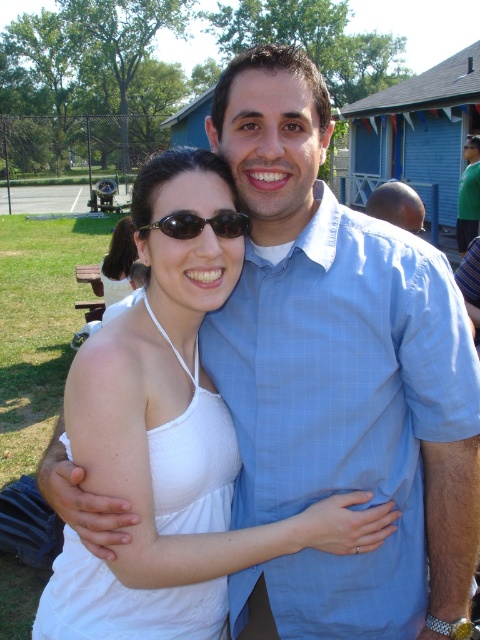
Question: From the image, what is the correct spatial relationship of black plastic goggles at upper center in relation to green fabric shirt at right?

Choices:
 (A) left
 (B) right

Answer: (A)

Question: Observing the image, what is the correct spatial positioning of smooth bald head at center in reference to green fabric shirt at right?

Choices:
 (A) left
 (B) right

Answer: (A)

Question: Which point is closer to the camera?

Choices:
 (A) black plastic goggles at upper center
 (B) smooth bald head at center

Answer: (A)

Question: Which of the following is the closest to the observer?

Choices:
 (A) (459, 182)
 (B) (107, 280)
 (C) (245, 225)

Answer: (C)

Question: Observing the image, what is the correct spatial positioning of smooth bald head at center in reference to white fabric top at center?

Choices:
 (A) above
 (B) below

Answer: (B)

Question: Which object is closer to the camera taking this photo?

Choices:
 (A) black plastic goggles at upper center
 (B) white fabric top at center
 (C) smooth bald head at center

Answer: (A)